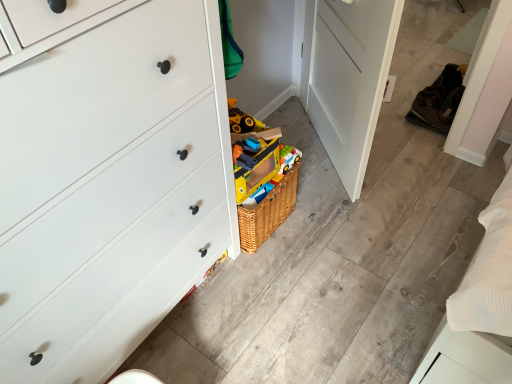
Question: Is brown suede shoe at right, the 2th shoe when ordered from right to left, far from white matte chest of drawers at left?

Choices:
 (A) no
 (B) yes

Answer: (B)

Question: Does brown suede shoe at right, the first shoe in the left-to-right sequence, have a greater height compared to white matte chest of drawers at left?

Choices:
 (A) yes
 (B) no

Answer: (B)

Question: From the image's perspective, does brown suede shoe at right, the first shoe in the left-to-right sequence, appear lower than white matte chest of drawers at left?

Choices:
 (A) no
 (B) yes

Answer: (A)

Question: Is brown suede shoe at right, the 2th shoe when ordered from right to left, smaller than white matte chest of drawers at left?

Choices:
 (A) no
 (B) yes

Answer: (B)

Question: Considering the relative sizes of brown suede shoe at right, the 2th shoe when ordered from right to left, and white matte chest of drawers at left in the image provided, is brown suede shoe at right, the 2th shoe when ordered from right to left, wider than white matte chest of drawers at left?

Choices:
 (A) yes
 (B) no

Answer: (B)

Question: Is the depth of brown suede shoe at right, the 2th shoe when ordered from right to left, less than that of white matte chest of drawers at left?

Choices:
 (A) yes
 (B) no

Answer: (B)

Question: Is brown leather shoe at right, the 2th shoe in the left-to-right sequence, to the right of brown suede shoe at right, the first shoe in the left-to-right sequence, from the viewer's perspective?

Choices:
 (A) yes
 (B) no

Answer: (A)

Question: From a real-world perspective, is brown leather shoe at right, the 2th shoe in the left-to-right sequence, positioned under brown suede shoe at right, the 2th shoe when ordered from right to left, based on gravity?

Choices:
 (A) yes
 (B) no

Answer: (B)

Question: Considering the relative sizes of brown leather shoe at right, the 2th shoe in the left-to-right sequence, and brown suede shoe at right, the 2th shoe when ordered from right to left, in the image provided, is brown leather shoe at right, the 2th shoe in the left-to-right sequence, smaller than brown suede shoe at right, the 2th shoe when ordered from right to left,?

Choices:
 (A) yes
 (B) no

Answer: (B)

Question: From the image's perspective, does brown leather shoe at right, the 2th shoe in the left-to-right sequence, appear lower than brown suede shoe at right, the first shoe in the left-to-right sequence?

Choices:
 (A) yes
 (B) no

Answer: (B)

Question: Is brown leather shoe at right, which appears as the first shoe when viewed from the right, looking in the opposite direction of brown suede shoe at right, the first shoe in the left-to-right sequence?

Choices:
 (A) no
 (B) yes

Answer: (A)

Question: Are brown leather shoe at right, which appears as the first shoe when viewed from the right, and brown suede shoe at right, the first shoe in the left-to-right sequence, far apart?

Choices:
 (A) no
 (B) yes

Answer: (A)

Question: Is white matte chest of drawers at left thinner than brown suede shoe at right, the first shoe in the left-to-right sequence?

Choices:
 (A) yes
 (B) no

Answer: (B)